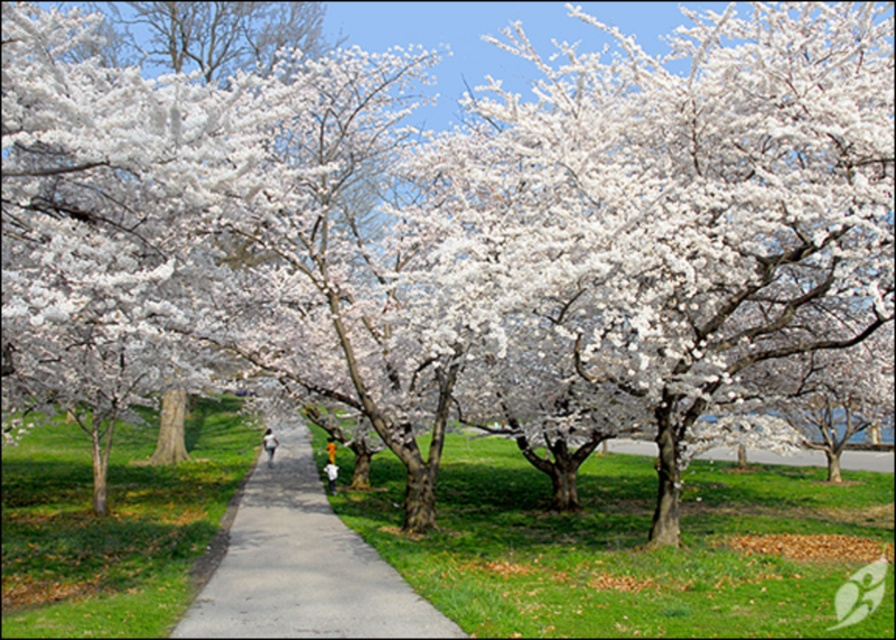
Question: Does gray concrete pavement at center appear on the right side of white fluffy petals at center?

Choices:
 (A) yes
 (B) no

Answer: (B)

Question: Which point appears closest to the camera in this image?

Choices:
 (A) (201, 592)
 (B) (171, 45)

Answer: (A)

Question: Is gray concrete pavement at center below white fluffy petals at center?

Choices:
 (A) yes
 (B) no

Answer: (A)

Question: Among these points, which one is farthest from the camera?

Choices:
 (A) (496, 60)
 (B) (304, 586)

Answer: (A)

Question: Can you confirm if gray concrete pavement at center is positioned below white fluffy petals at center?

Choices:
 (A) no
 (B) yes

Answer: (B)